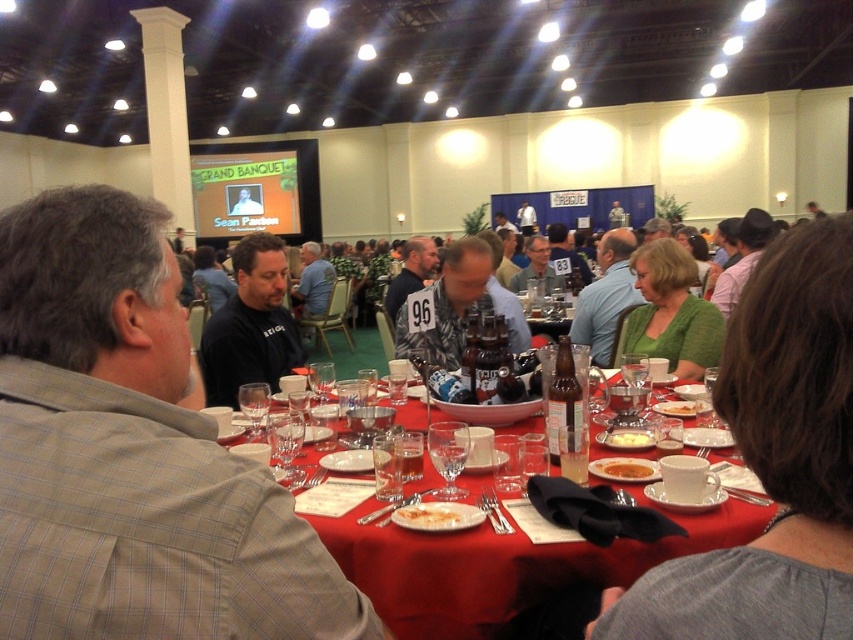
Question: Which point is closer to the camera?

Choices:
 (A) black matte shirt at center
 (B) gray checkered shirt at left
 (C) red cloth table at center

Answer: (B)

Question: Is camouflage shirt at center below white creamy cake at center?

Choices:
 (A) yes
 (B) no

Answer: (B)

Question: Can you confirm if green knitwear at center is bigger than white creamy cake at center?

Choices:
 (A) no
 (B) yes

Answer: (B)

Question: Which object is closer to the camera taking this photo?

Choices:
 (A) red cloth table at center
 (B) gray checkered shirt at left
 (C) green knitted sweater at center

Answer: (B)

Question: Which point is closer to the camera taking this photo?

Choices:
 (A) (627, 464)
 (B) (296, 528)

Answer: (B)

Question: Observing the image, what is the correct spatial positioning of black matte shirt at center in reference to white creamy mashed potatoes at center?

Choices:
 (A) right
 (B) left

Answer: (B)